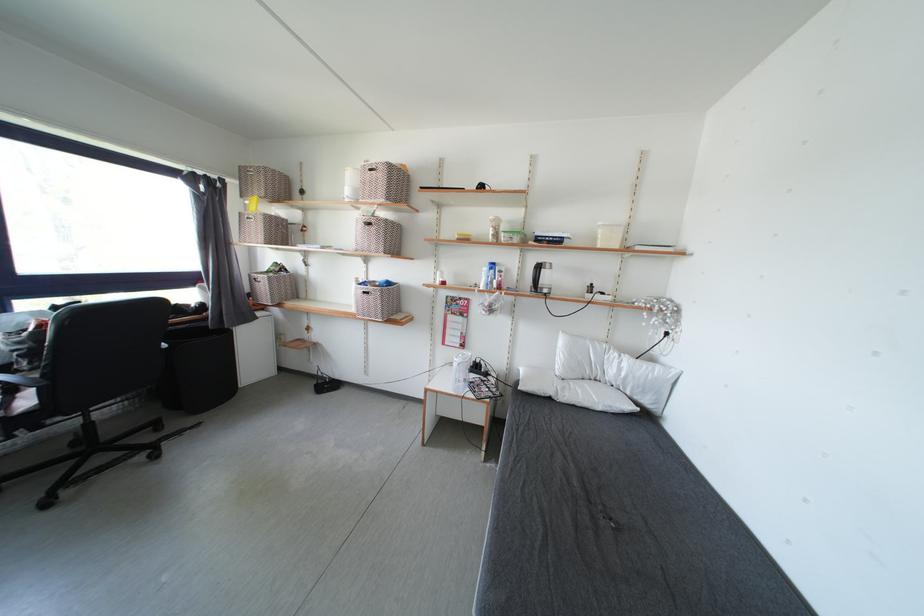
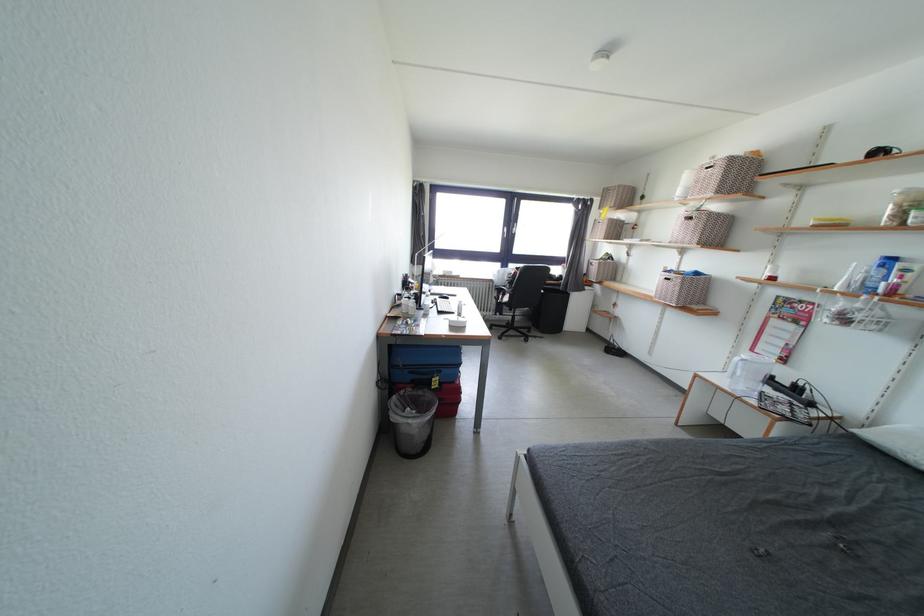
Find the pixel in the second image that matches (x=450, y=349) in the first image.

(759, 355)